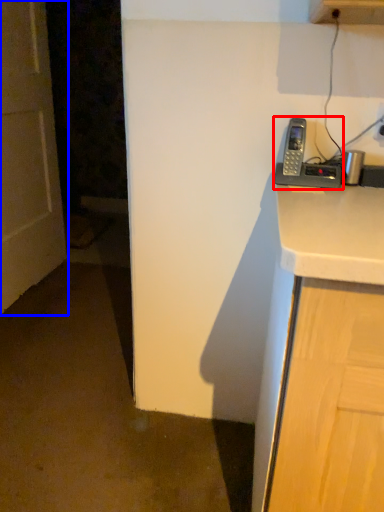
Question: Among these objects, which one is farthest to the camera, corded phone (highlighted by a red box) or door (highlighted by a blue box)?

Choices:
 (A) corded phone
 (B) door

Answer: (B)